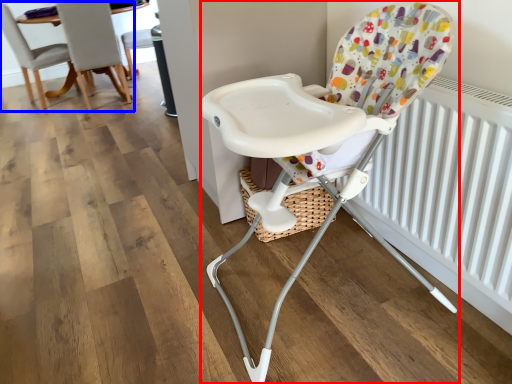
Question: Among these objects, which one is farthest to the camera, chair (highlighted by a red box) or chair (highlighted by a blue box)?

Choices:
 (A) chair
 (B) chair

Answer: (B)